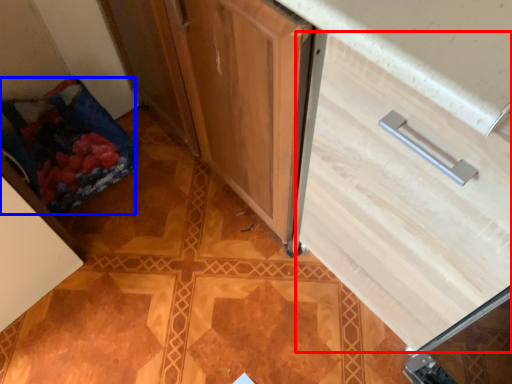
Question: Among these objects, which one is farthest to the camera, drawer (highlighted by a red box) or material (highlighted by a blue box)?

Choices:
 (A) drawer
 (B) material

Answer: (B)